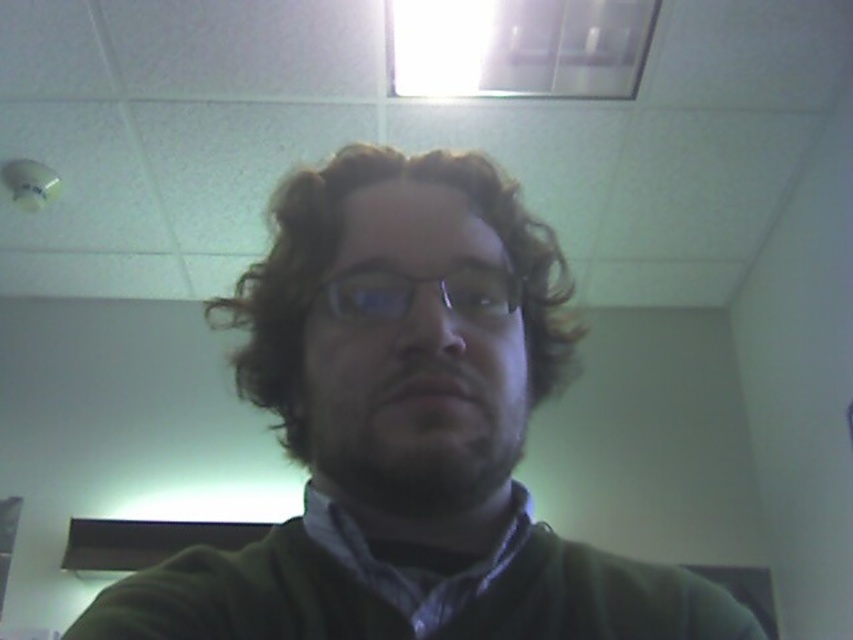
Question: Where is green matte sweater at center located in relation to clear plastic glasses at center in the image?

Choices:
 (A) left
 (B) right

Answer: (B)

Question: Among these objects, which one is nearest to the camera?

Choices:
 (A) dark brown fuzzy beard at center
 (B) green matte sweater at center
 (C) clear plastic glasses at center

Answer: (A)

Question: Which point is farther to the camera?

Choices:
 (A) (427, 502)
 (B) (289, 216)
 (C) (315, 400)
 (D) (450, 296)

Answer: (B)

Question: Can you confirm if green matte sweater at center is thinner than curly brown hair at center?

Choices:
 (A) yes
 (B) no

Answer: (A)

Question: Is green matte sweater at center further to the viewer compared to dark brown fuzzy beard at center?

Choices:
 (A) yes
 (B) no

Answer: (A)

Question: Which point appears farthest from the camera in this image?

Choices:
 (A) (517, 301)
 (B) (299, 413)
 (C) (462, 420)
 (D) (556, 256)

Answer: (D)